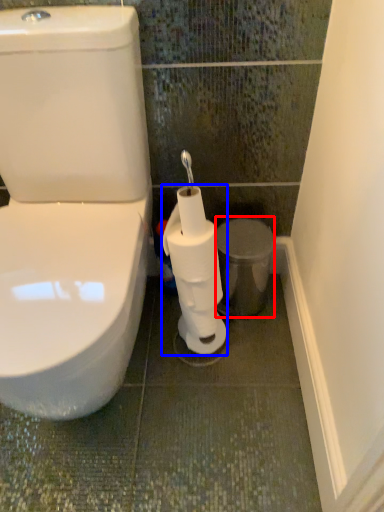
Question: Which point is closer to the camera, porcelain (highlighted by a red box) or toilet paper (highlighted by a blue box)?

Choices:
 (A) porcelain
 (B) toilet paper

Answer: (B)